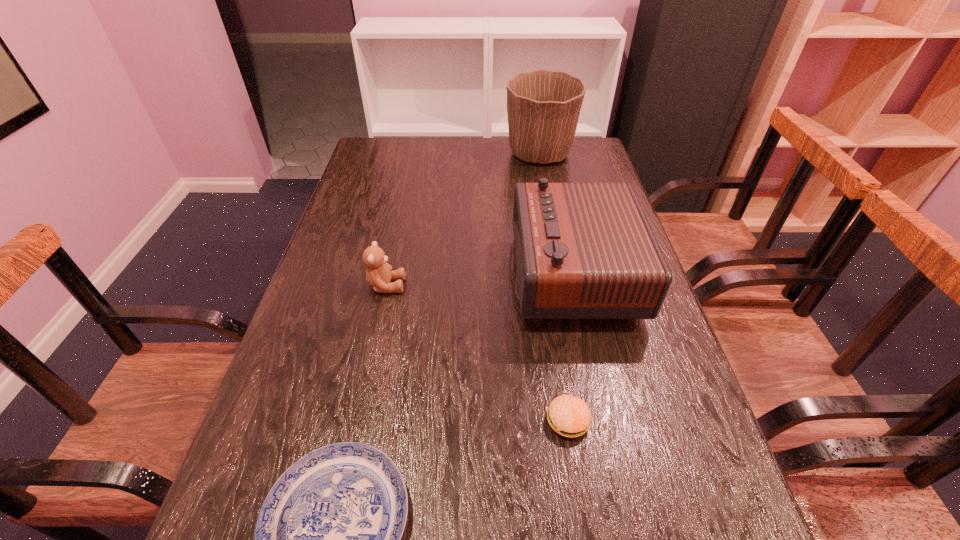
I want to click on free space between the radio receiver and the teddy bear, so click(x=480, y=279).

This screenshot has width=960, height=540. In order to click on vacant area that lies between the fourth farthest object and the radio receiver in this screenshot , I will do `click(570, 347)`.

You are a GUI agent. You are given a task and a screenshot of the screen. Output one action in this format:
    pyautogui.click(x=<x>, y=<y>)
    Task: Click on the free space between the teddy bear and the second tallest object
    The width and height of the screenshot is (960, 540).
    Given the screenshot: What is the action you would take?
    pyautogui.click(x=480, y=279)

Locate which object ranks second in proximity to the second tallest object. Please provide its 2D coordinates. Your answer should be formatted as a tuple, i.e. [(x, y)], where the tuple contains the x and y coordinates of a point satisfying the conditions above.

[(378, 274)]

The height and width of the screenshot is (540, 960). Find the location of `object that stands as the fourth closest to the farthest object`. object that stands as the fourth closest to the farthest object is located at coordinates (327, 539).

The width and height of the screenshot is (960, 540). I want to click on vacant space that satisfies the following two spatial constraints: 1. on the face of the teddy bear; 2. on the left side of the patty, so click(x=357, y=420).

At what (x,y) coordinates should I click in order to perform the action: click on vacant point that satisfies the following two spatial constraints: 1. on the face of the teddy bear; 2. on the right side of the fourth tallest object. Please return your answer as a coordinate pair (x, y). Looking at the image, I should click on (357, 420).

Where is `vacant region that satisfies the following two spatial constraints: 1. on the face of the third tallest object; 2. on the back side of the patty`? vacant region that satisfies the following two spatial constraints: 1. on the face of the third tallest object; 2. on the back side of the patty is located at coordinates (357, 420).